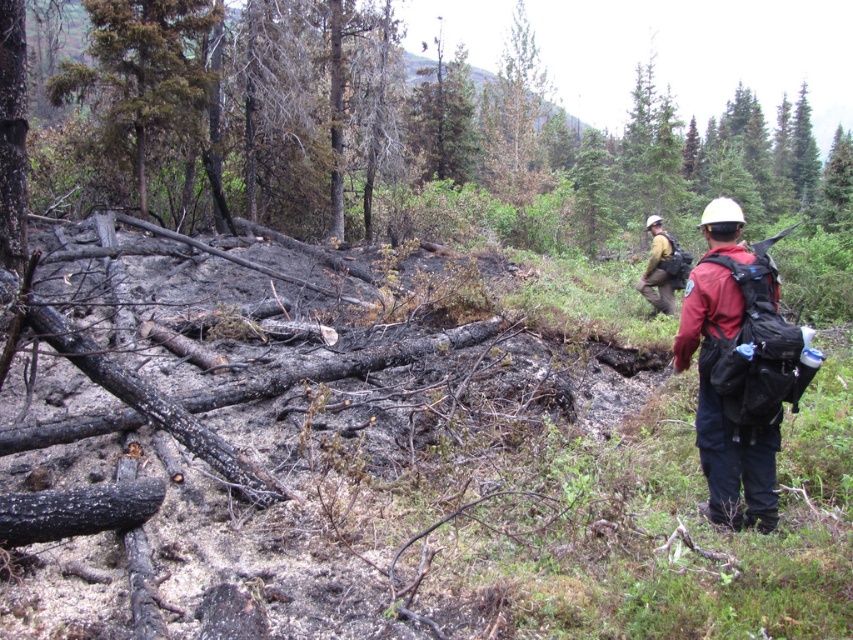
Question: Can you confirm if matte red jacket at right is wider than camouflage jacket at right?

Choices:
 (A) yes
 (B) no

Answer: (B)

Question: From the image, what is the correct spatial relationship of matte red jacket at right in relation to camouflage jacket at right?

Choices:
 (A) above
 (B) below

Answer: (B)

Question: Is dark green coniferous tree at upper left thinner than camouflage jacket at right?

Choices:
 (A) yes
 (B) no

Answer: (A)

Question: Which object appears closest to the camera in this image?

Choices:
 (A) dark green coniferous tree at upper left
 (B) camouflage jacket at right

Answer: (B)

Question: Estimate the real-world distances between objects in this image. Which object is closer to the dark green coniferous tree at upper left?

Choices:
 (A) camouflage jacket at right
 (B) matte red jacket at right

Answer: (A)

Question: Which is nearer to the dark green coniferous tree at upper left?

Choices:
 (A) camouflage jacket at right
 (B) matte red jacket at right

Answer: (A)